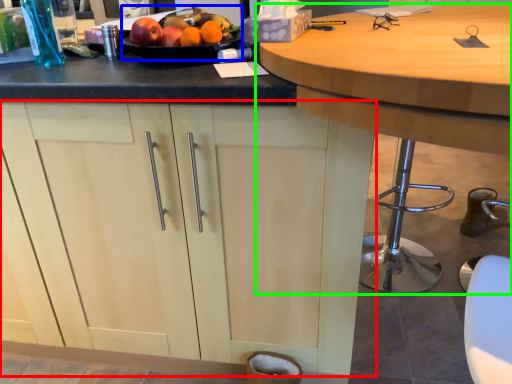
Question: Based on their relative distances, which object is nearer to cabinetry (highlighted by a red box)? Choose from fruit dish (highlighted by a blue box) and table (highlighted by a green box).

Choices:
 (A) fruit dish
 (B) table

Answer: (A)